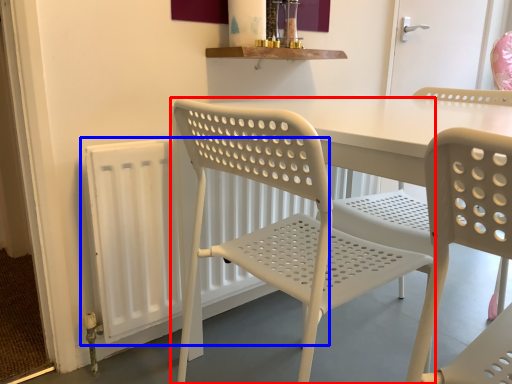
Question: Among these objects, which one is nearest to the camera, chair (highlighted by a red box) or radiator (highlighted by a blue box)?

Choices:
 (A) chair
 (B) radiator

Answer: (A)